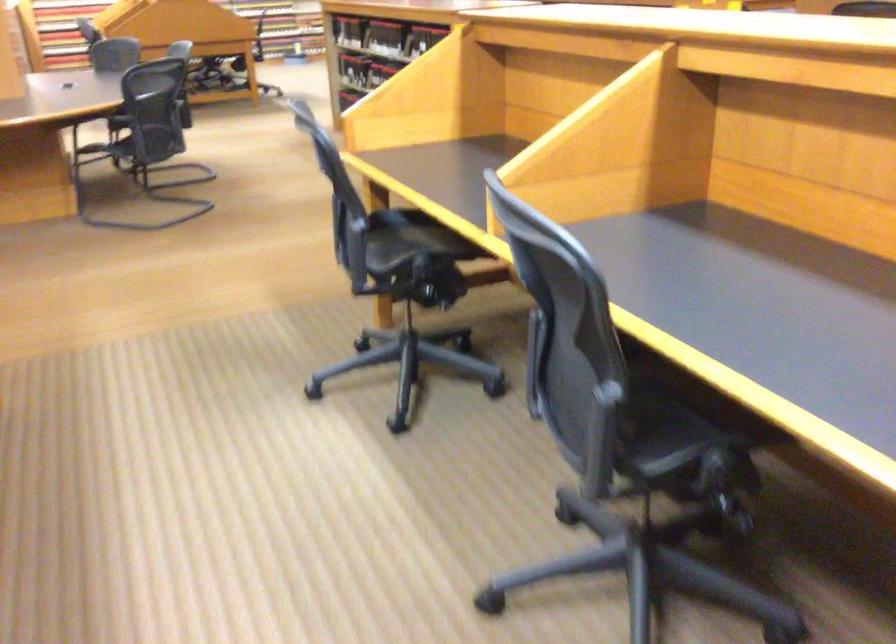
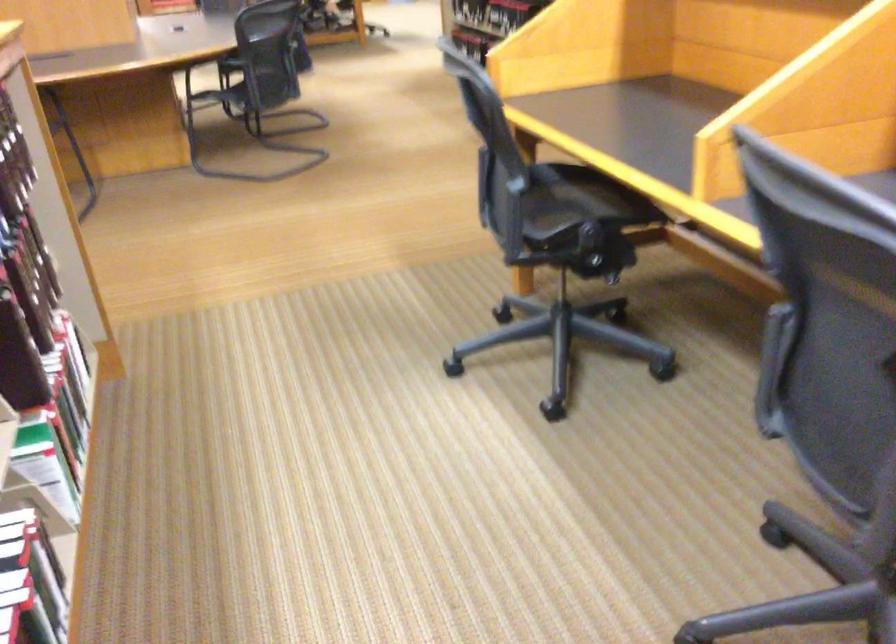
Locate, in the second image, the point that corresponds to point (494, 277) in the first image.

(648, 237)